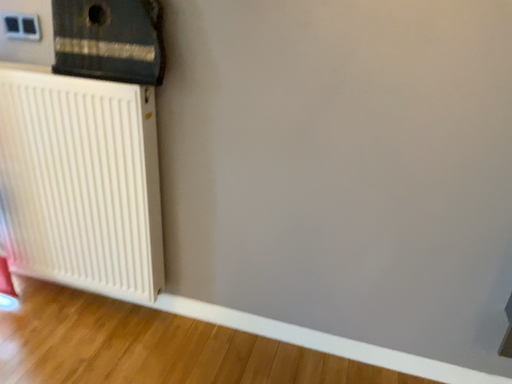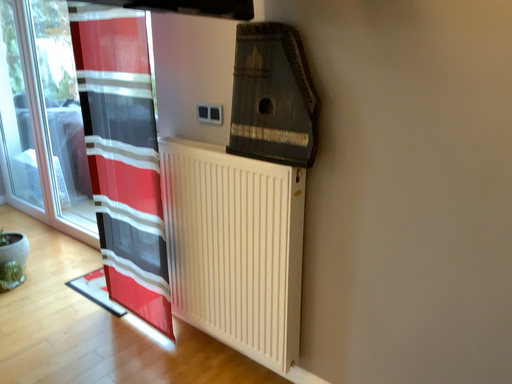
Question: Which way did the camera rotate in the video?

Choices:
 (A) rotated right
 (B) rotated left

Answer: (B)